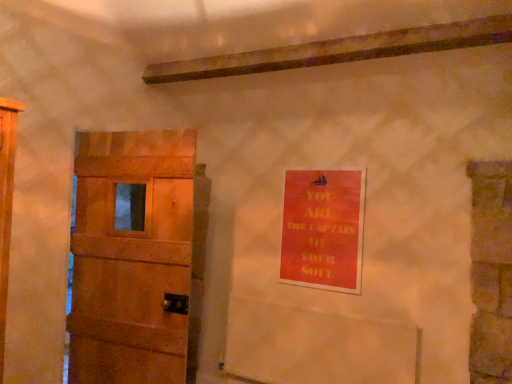
Question: From a real-world perspective, is wooden door at left under orange matte poster at upper right?

Choices:
 (A) yes
 (B) no

Answer: (A)

Question: From the image's perspective, would you say wooden door at left is shown under orange matte poster at upper right?

Choices:
 (A) yes
 (B) no

Answer: (A)

Question: Considering the relative sizes of wooden door at left and orange matte poster at upper right in the image provided, is wooden door at left thinner than orange matte poster at upper right?

Choices:
 (A) yes
 (B) no

Answer: (B)

Question: Is wooden door at left far from orange matte poster at upper right?

Choices:
 (A) yes
 (B) no

Answer: (A)

Question: From a real-world perspective, is wooden door at left over orange matte poster at upper right?

Choices:
 (A) no
 (B) yes

Answer: (A)

Question: Can you confirm if wooden door at left is bigger than orange matte poster at upper right?

Choices:
 (A) yes
 (B) no

Answer: (A)

Question: Is orange matte poster at upper right further to camera compared to wooden door at left?

Choices:
 (A) no
 (B) yes

Answer: (B)

Question: From a real-world perspective, is orange matte poster at upper right on top of wooden door at left?

Choices:
 (A) no
 (B) yes

Answer: (B)

Question: From the image's perspective, is orange matte poster at upper right under wooden door at left?

Choices:
 (A) no
 (B) yes

Answer: (A)

Question: From the image's perspective, is orange matte poster at upper right above wooden door at left?

Choices:
 (A) yes
 (B) no

Answer: (A)

Question: Is orange matte poster at upper right thinner than wooden door at left?

Choices:
 (A) no
 (B) yes

Answer: (B)

Question: Is orange matte poster at upper right beside wooden door at left?

Choices:
 (A) yes
 (B) no

Answer: (B)

Question: From a real-world perspective, is orange matte poster at upper right positioned above or below wooden door at left?

Choices:
 (A) above
 (B) below

Answer: (A)